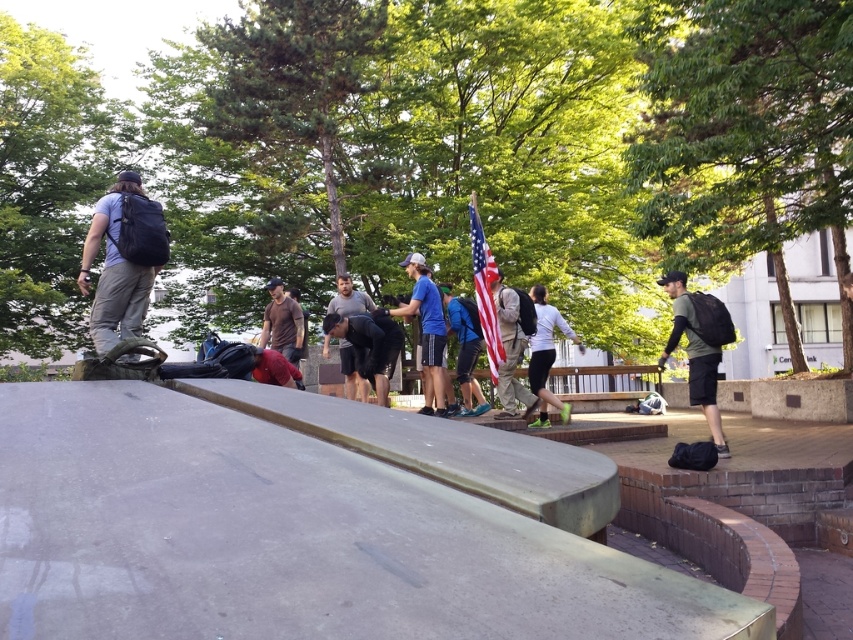
Question: Does white matte shirt at center appear under brown matte shirt at center?

Choices:
 (A) yes
 (B) no

Answer: (A)

Question: Does white matte shirt at center have a lesser width compared to brown matte shirt at center?

Choices:
 (A) no
 (B) yes

Answer: (A)

Question: Which object is positioned farthest from the black matte skateboard at center?

Choices:
 (A) dark gray fabric backpack at center
 (B) matte black backpack at upper left
 (C) blue fabric shirt at center
 (D) khaki pants at center

Answer: (B)

Question: Estimate the real-world distances between objects in this image. Which object is closer to the khaki pants at center?

Choices:
 (A) black matte skateboard at center
 (B) matte green t-shirt at right

Answer: (A)

Question: Which point is farther from the camera taking this photo?

Choices:
 (A) (503, 352)
 (B) (706, 396)
 (C) (165, 253)
 (D) (277, 300)

Answer: (D)

Question: Does khaki pants at center appear under brown matte shirt at center?

Choices:
 (A) yes
 (B) no

Answer: (A)